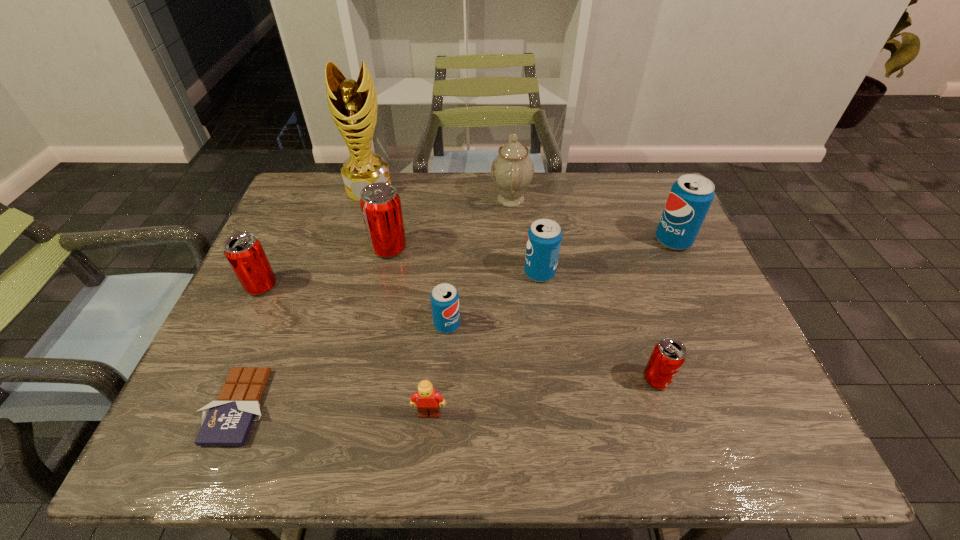
The height and width of the screenshot is (540, 960). Identify the location of free space between the fifth farthest soda can and the Lego. (438, 369).

Where is `unoccupied area between the rightmost soda can and the gold award`? unoccupied area between the rightmost soda can and the gold award is located at coordinates (521, 214).

You are a GUI agent. You are given a task and a screenshot of the screen. Output one action in this format:
    pyautogui.click(x=<x>, y=<y>)
    Task: Click on the vacant space that is in between the nearest red soda can and the third soda can from right to left
    The height and width of the screenshot is (540, 960).
    Given the screenshot: What is the action you would take?
    pyautogui.click(x=598, y=326)

This screenshot has width=960, height=540. What are the coordinates of `object that can be found as the fourth closest to the fifth soda can from left to right` in the screenshot? It's located at (429, 401).

In order to click on object that stands as the sixth closest to the second nearest red soda can in this screenshot , I will do `click(512, 170)`.

Select which soda can is the second closest to the shortest object. Please provide its 2D coordinates. Your answer should be formatted as a tuple, i.e. [(x, y)], where the tuple contains the x and y coordinates of a point satisfying the conditions above.

[(444, 298)]

Where is `soda can that is the second nearest to the chinaware`? soda can that is the second nearest to the chinaware is located at coordinates (380, 203).

Where is `the second closest blue soda can to the biggest blue soda can`? The height and width of the screenshot is (540, 960). the second closest blue soda can to the biggest blue soda can is located at coordinates (444, 298).

Identify the location of the closest blue soda can to the biggest red soda can. The width and height of the screenshot is (960, 540). (444, 298).

Identify which red soda can is located as the second nearest to the biggest red soda can. Please provide its 2D coordinates. Your answer should be formatted as a tuple, i.e. [(x, y)], where the tuple contains the x and y coordinates of a point satisfying the conditions above.

[(669, 354)]